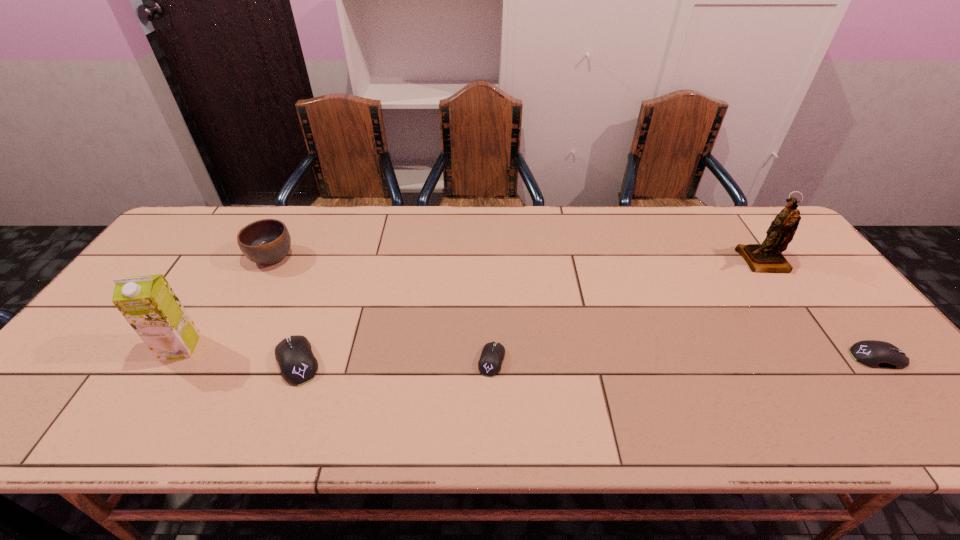
At what (x,y) coordinates should I click in order to perform the action: click on the third shortest object. Please return your answer as a coordinate pair (x, y). Looking at the image, I should click on (294, 355).

At what (x,y) coordinates should I click in order to perform the action: click on the leftmost computer equipment. Please return your answer as a coordinate pair (x, y). The width and height of the screenshot is (960, 540). Looking at the image, I should click on (294, 355).

The image size is (960, 540). I want to click on the shortest object, so 489,364.

Where is `the shortest computer equipment`? the shortest computer equipment is located at coordinates (489, 364).

You are a GUI agent. You are given a task and a screenshot of the screen. Output one action in this format:
    pyautogui.click(x=<x>, y=<y>)
    Task: Click on the second tallest computer equipment
    The height and width of the screenshot is (540, 960).
    Given the screenshot: What is the action you would take?
    pyautogui.click(x=876, y=354)

Find the location of a particular element. The image size is (960, 540). the rightmost computer equipment is located at coordinates (876, 354).

Where is `bowl`? The height and width of the screenshot is (540, 960). bowl is located at coordinates (266, 242).

The height and width of the screenshot is (540, 960). I want to click on figurine, so click(x=767, y=257).

Identify the location of soya milk. The height and width of the screenshot is (540, 960). (149, 304).

Find the location of a particular element. The height and width of the screenshot is (540, 960). vacant region located on the right of the tallest computer equipment is located at coordinates (426, 361).